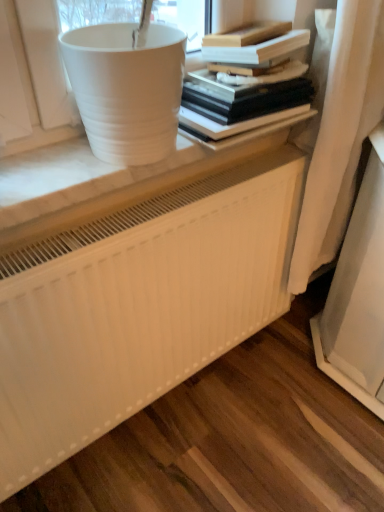
Locate an element on the screen. The height and width of the screenshot is (512, 384). hardcover books at upper center is located at coordinates (241, 97).

The width and height of the screenshot is (384, 512). Describe the element at coordinates (241, 97) in the screenshot. I see `hardcover books at upper center` at that location.

In order to click on hardcover books at upper center in this screenshot , I will do `click(241, 97)`.